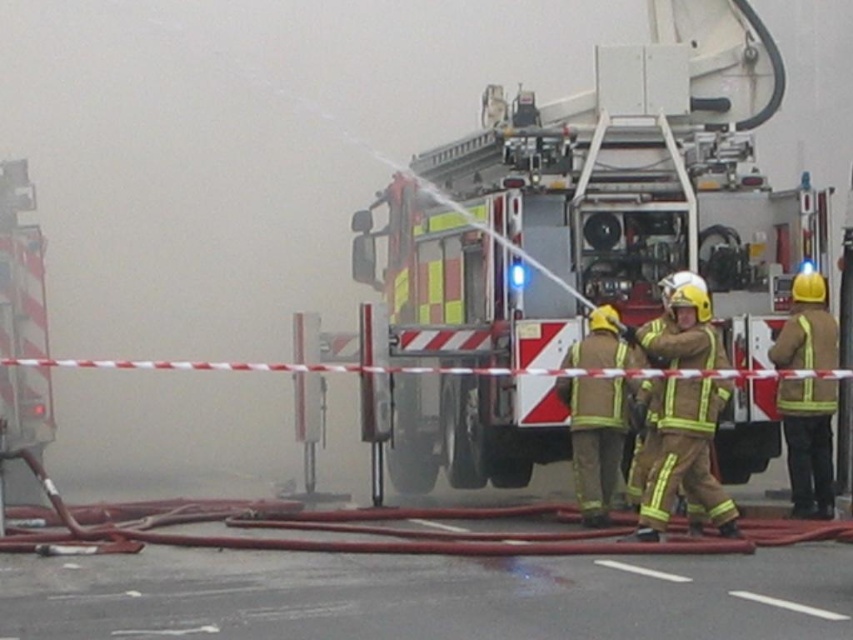
Which is behind, point (709, 497) or point (770, 348)?

The point (770, 348) is more distant.

Measure the distance from yellow reflective uniform at center to yellow reflective uniform at right.

yellow reflective uniform at center and yellow reflective uniform at right are 1.58 meters apart.

Measure the distance between yellow reflective uniform at center and camera.

yellow reflective uniform at center and camera are 37.45 feet apart from each other.

Identify the location of yellow reflective uniform at center. pyautogui.click(x=685, y=458).

The image size is (853, 640). I want to click on reflective silver fire truck at center, so click(601, 202).

Does point (738, 289) come closer to viewer compared to point (611, 368)?

No, (738, 289) is behind (611, 368).

You are a GUI agent. You are given a task and a screenshot of the screen. Output one action in this format:
    pyautogui.click(x=<x>, y=<y>)
    Task: Click on the reflective silver fire truck at center
    This screenshot has height=640, width=853.
    Given the screenshot: What is the action you would take?
    pyautogui.click(x=601, y=202)

Is yellow reflective uniform at right taller than reflective gold helmet at center?

Indeed, yellow reflective uniform at right has a greater height compared to reflective gold helmet at center.

Does point (820, 326) lie behind point (605, 499)?

No, (820, 326) is in front of (605, 499).

Locate an element on the screen. The width and height of the screenshot is (853, 640). yellow reflective uniform at right is located at coordinates (808, 442).